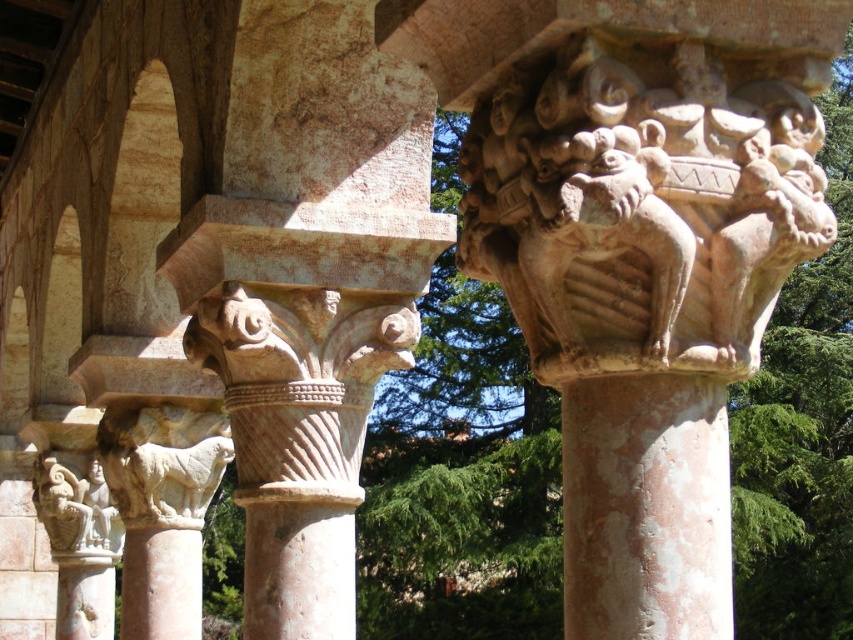
You are an architect examining the historical structure. You notice the beige stone sculpture at center and the pink stone column at center. Which object is shorter in height?

The beige stone sculpture at center is not as tall as the pink stone column at center, so the beige stone sculpture at center is shorter.

Based on the scene description, where is the marble column at center located in terms of its 2D coordinates?

The marble column at center is located at the 2D coordinates point (306, 284).

Consider the image. You are an architect examining the historical structure. You notice the marble column at center and the white stone statue at lower left. From your vantage point, which object appears closer to you?

The marble column at center is in front of the white stone statue at lower left, so it appears closer to you.